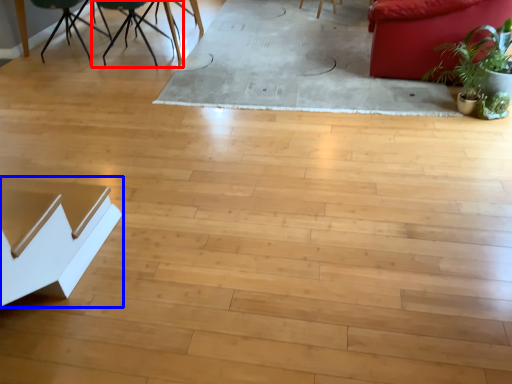
Question: Which point is further to the camera, chair (highlighted by a red box) or table (highlighted by a blue box)?

Choices:
 (A) chair
 (B) table

Answer: (A)